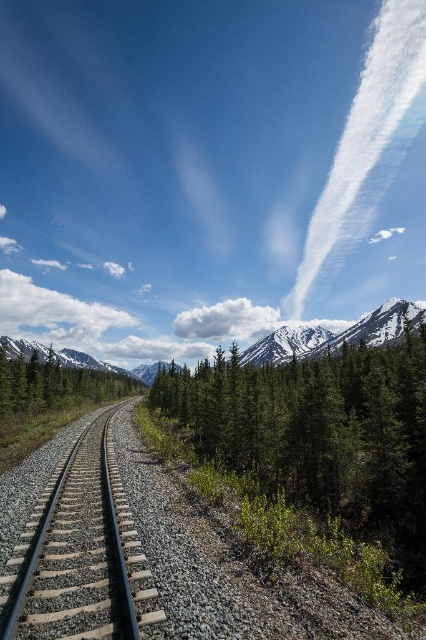
You are standing at the railway tracks and see the green matte tree at left and the snowy granite mountain at upper center. Which object is wider from your perspective?

The green matte tree at left is wider than the snowy granite mountain at upper center from your perspective.

You are standing at the origin point of the image. Which direction should you move to reach the green matte tree at center?

The green matte tree at center is located at point (317,428), so you should move towards the upper right direction from your current position to reach it.